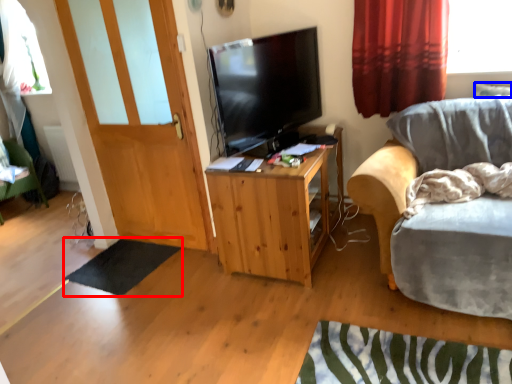
Question: Which object appears closest to the camera in this image, flat (highlighted by a red box) or pillow (highlighted by a blue box)?

Choices:
 (A) flat
 (B) pillow

Answer: (B)